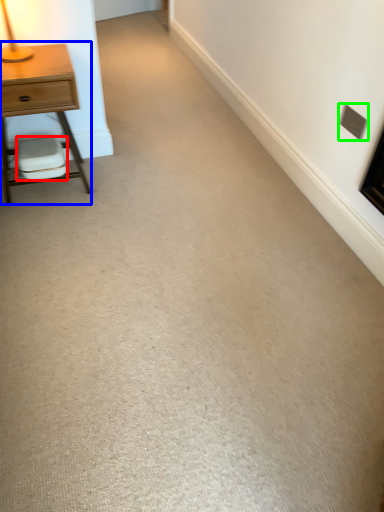
Question: Estimate the real-world distances between objects in this image. Which object is closer to swivel chair (highlighted by a red box), nightstand (highlighted by a blue box) or electric outlet (highlighted by a green box)?

Choices:
 (A) nightstand
 (B) electric outlet

Answer: (A)